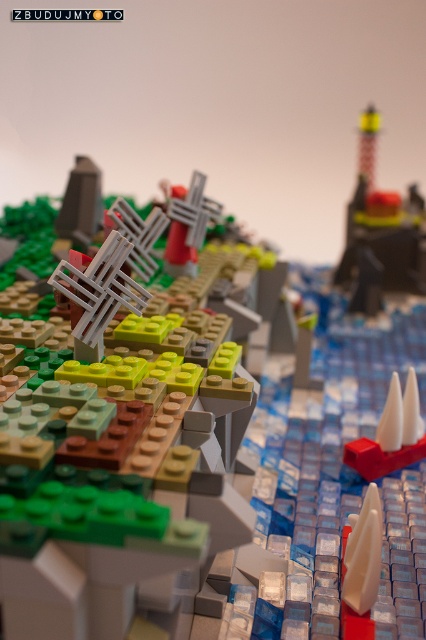
Does point (417, 289) come farther from viewer compared to point (362, 449)?

Yes, it is.

Is point (359, 179) less distant than point (367, 458)?

That is False.

Which is behind, point (386, 225) or point (405, 428)?

The point (386, 225) is behind.

At what (x,y) coordinates should I click in order to perform the action: click on smooth black lighthouse at upper right. Please return your answer as a coordinate pair (x, y). Image resolution: width=426 pixels, height=640 pixels. Looking at the image, I should click on (379, 234).